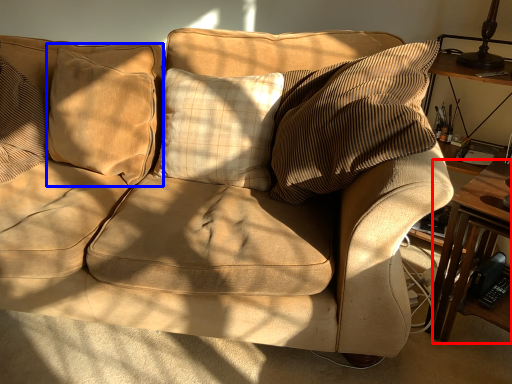
Question: Among these objects, which one is nearest to the camera, table (highlighted by a red box) or pillow (highlighted by a blue box)?

Choices:
 (A) table
 (B) pillow

Answer: (A)